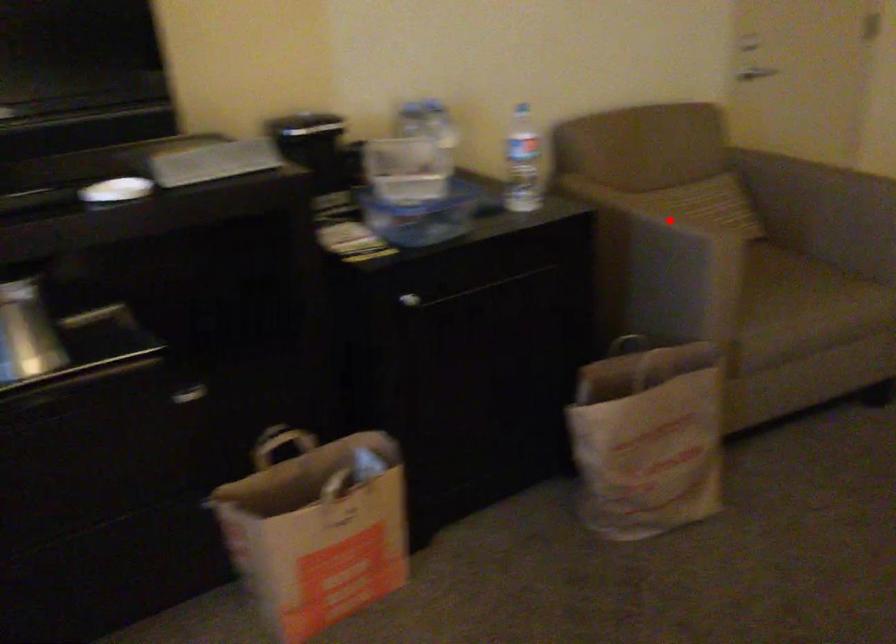
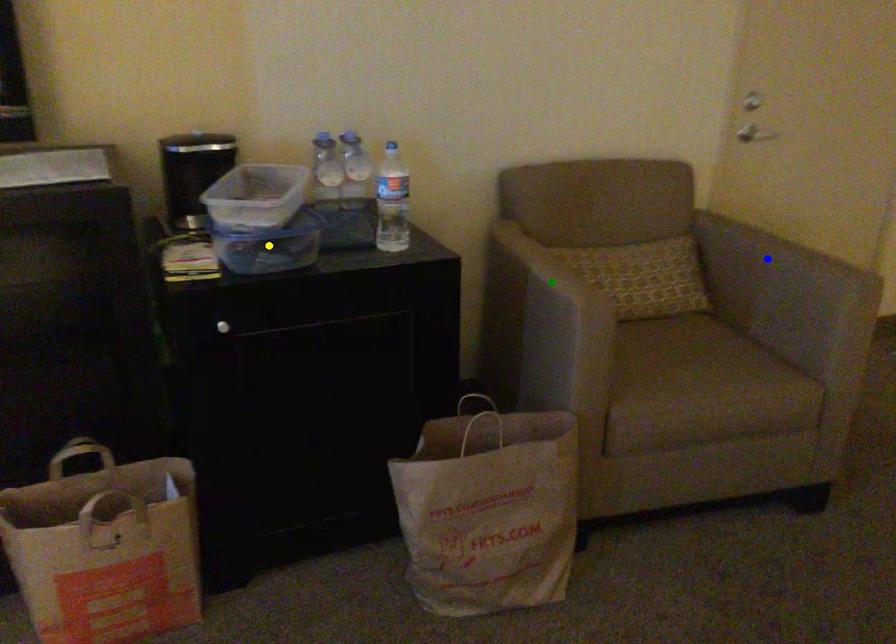
Question: I am providing you with two images of the same scene from different viewpoints. A red point is marked on the first image. You are given multiple points on the second image. Which point in image 2 is actually the same real-world point as the red point in image 1?

Choices:
 (A) blue point
 (B) green point
 (C) yellow point

Answer: (B)